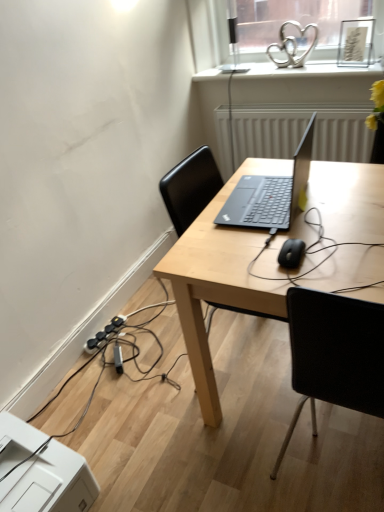
Question: Do you think white textured radiator at center is within black matte mouse at center, or outside of it?

Choices:
 (A) inside
 (B) outside

Answer: (B)

Question: From the image's perspective, is white textured radiator at center above or below black matte mouse at center?

Choices:
 (A) below
 (B) above

Answer: (B)

Question: Which is nearer to the white glossy heart-shaped object at upper center?

Choices:
 (A) white plastic printer at lower left
 (B) black plastic extension cord at lower left
 (C) sleek silver laptop at center
 (D) black matte mouse at center
 (E) white textured radiator at center

Answer: (E)

Question: Which object is positioned closest to the black plastic extension cord at lower left?

Choices:
 (A) sleek silver laptop at center
 (B) white textured radiator at center
 (C) black matte mouse at center
 (D) white glossy heart-shaped object at upper center
 (E) light wood desk at center

Answer: (E)